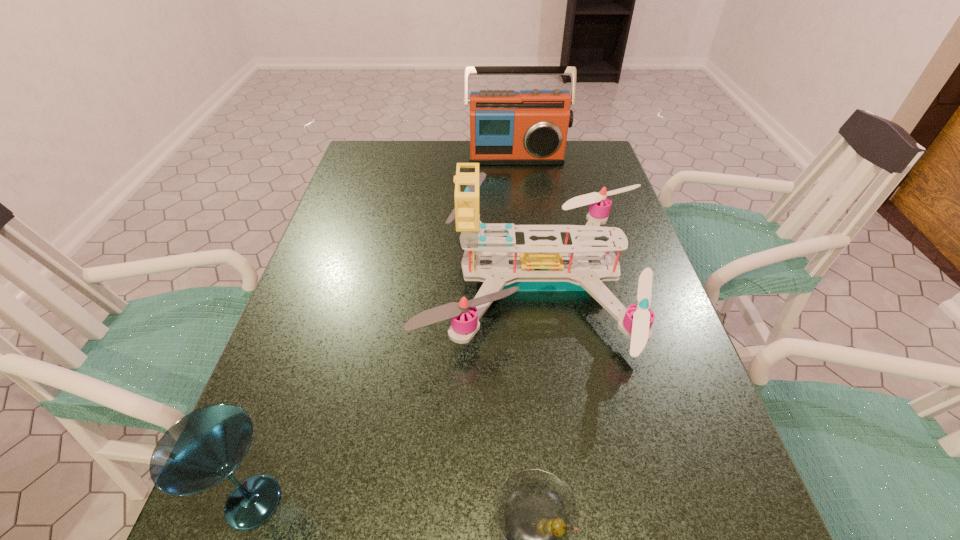
The height and width of the screenshot is (540, 960). In the image, there is a desktop. What are the coordinates of `vacant space at the far edge` in the screenshot? It's located at (510, 168).

Find the location of a particular element. The height and width of the screenshot is (540, 960). vacant space at the left edge of the desktop is located at coordinates (339, 380).

The width and height of the screenshot is (960, 540). In order to click on vacant space at the right edge of the desktop in this screenshot , I will do `click(622, 205)`.

Identify the location of free location at the far left corner. (403, 153).

Identify the location of vacant space at the far right corner of the desktop. The image size is (960, 540). (598, 168).

The height and width of the screenshot is (540, 960). Find the location of `the third closest object relative to the farthest object`. the third closest object relative to the farthest object is located at coordinates (537, 514).

Find the location of a particular element. This screenshot has height=540, width=960. object that is the nearest to the right martini is located at coordinates (540, 265).